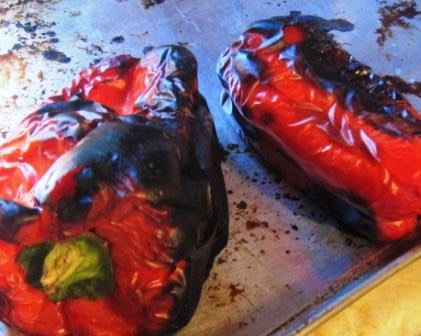
At what (x,y) coordinates should I click in order to perform the action: click on baking pan. Please return your answer as a coordinate pair (x, y). The width and height of the screenshot is (421, 336). Looking at the image, I should click on (255, 193).